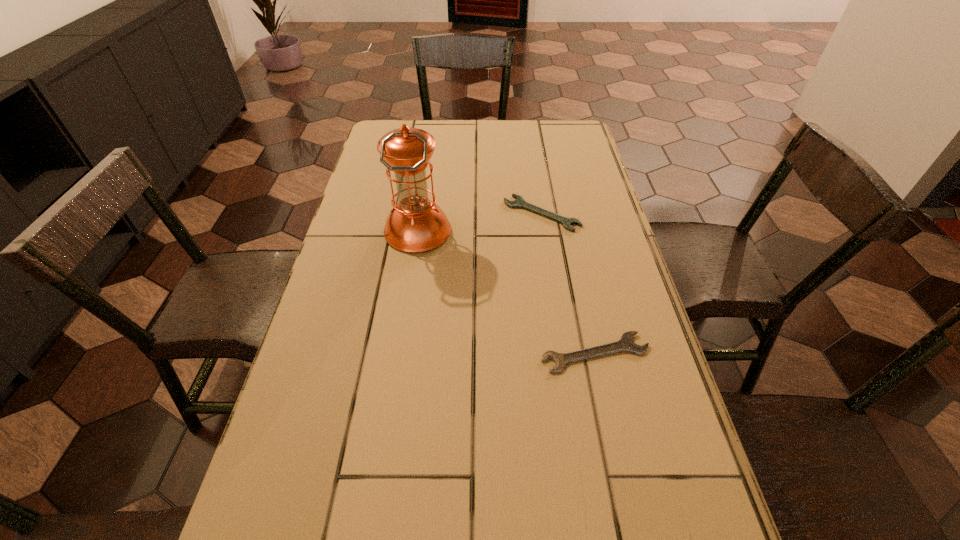
You are a GUI agent. You are given a task and a screenshot of the screen. Output one action in this format:
    pyautogui.click(x=<x>, y=<y>)
    Task: Click on the oil lamp
    The width and height of the screenshot is (960, 540).
    Given the screenshot: What is the action you would take?
    (416, 224)

This screenshot has height=540, width=960. What are the coordinates of `the tallest object` in the screenshot? It's located at (416, 224).

Where is `the farther wrench`? This screenshot has width=960, height=540. the farther wrench is located at coordinates (519, 202).

Locate an element on the screen. This screenshot has height=540, width=960. the nearer wrench is located at coordinates (626, 343).

Find the location of a particular element. free region located 0.380m on the right of the leftmost object is located at coordinates (588, 232).

You are a GUI agent. You are given a task and a screenshot of the screen. Output one action in this format:
    pyautogui.click(x=<x>, y=<y>)
    Task: Click on the vacant region located 0.130m on the left of the farther wrench
    
    Given the screenshot: What is the action you would take?
    pyautogui.click(x=460, y=213)

The image size is (960, 540). Find the location of `free location located 0.190m on the back of the nearest object`. free location located 0.190m on the back of the nearest object is located at coordinates (578, 273).

Locate an element on the screen. object located in the left edge section of the desktop is located at coordinates (416, 224).

Locate an element on the screen. The image size is (960, 540). vacant space at the left edge of the desktop is located at coordinates (381, 245).

Where is `vacant space at the right edge of the desktop`? vacant space at the right edge of the desktop is located at coordinates (570, 280).